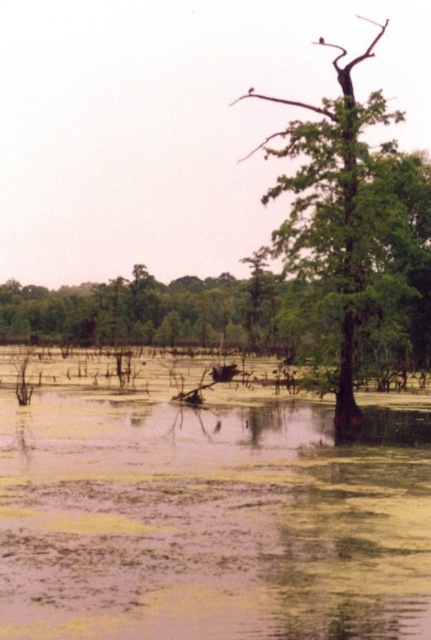
Which is in front, point (63, 422) or point (340, 116)?

Point (340, 116) is in front.

Image resolution: width=431 pixels, height=640 pixels. I want to click on green algae-covered water at center, so click(206, 512).